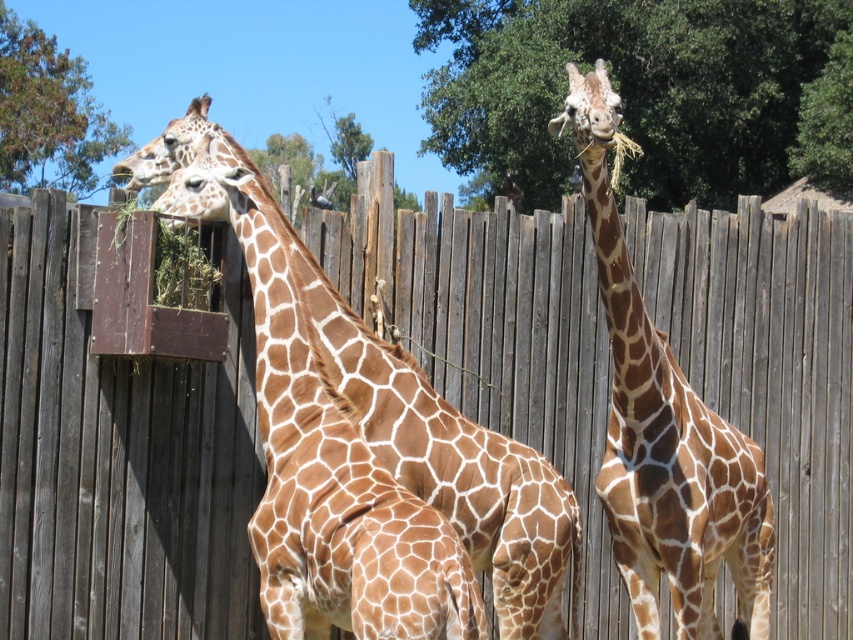
Question: Does brown wooden fence at left appear over brown spotted giraffe at left?

Choices:
 (A) no
 (B) yes

Answer: (A)

Question: Is brown wooden fence at left to the left of brown spotted giraffe at right from the viewer's perspective?

Choices:
 (A) yes
 (B) no

Answer: (A)

Question: Which point is farther from the camera taking this photo?

Choices:
 (A) (659, 509)
 (B) (287, 298)

Answer: (A)

Question: Which object appears closest to the camera in this image?

Choices:
 (A) brown spotted giraffe at right
 (B) brown spotted giraffe at left

Answer: (B)

Question: Estimate the real-world distances between objects in this image. Which object is farther from the brown wooden fence at left?

Choices:
 (A) brown spotted giraffe at right
 (B) brown spotted giraffe at left

Answer: (A)

Question: Is brown spotted giraffe at left in front of brown spotted giraffe at right?

Choices:
 (A) yes
 (B) no

Answer: (A)